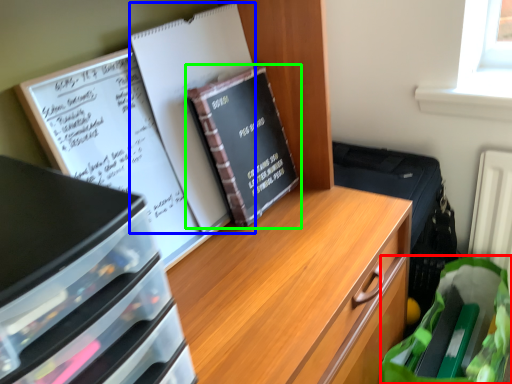
Question: Estimate the real-world distances between objects in this image. Which object is closer to grocery bag (highlighted by a red box), journal (highlighted by a blue box) or book (highlighted by a green box)?

Choices:
 (A) journal
 (B) book

Answer: (B)